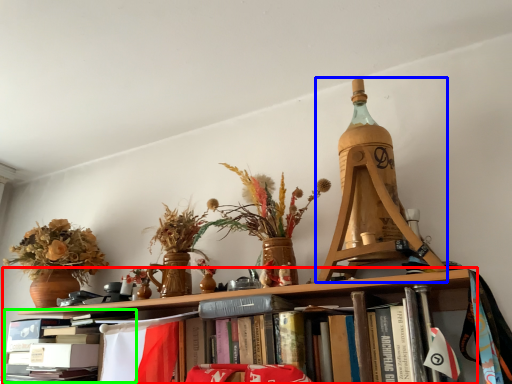
Question: Based on their relative distances, which object is nearer to shelf (highlighted by a red box)? Choose from Eiffel tower (highlighted by a blue box) and book (highlighted by a green box).

Choices:
 (A) Eiffel tower
 (B) book

Answer: (B)